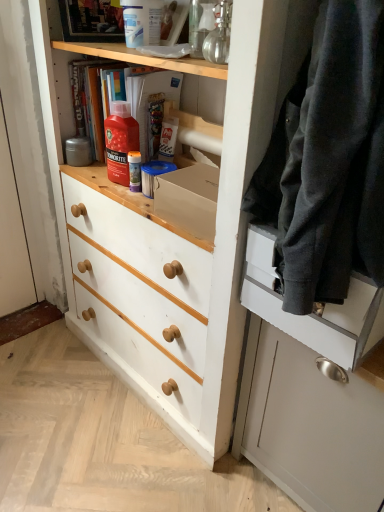
Question: Considering the relative positions of satin white cabinet at right and matte black drawer at right in the image provided, is satin white cabinet at right to the right of matte black drawer at right from the viewer's perspective?

Choices:
 (A) no
 (B) yes

Answer: (B)

Question: From a real-world perspective, is satin white cabinet at right positioned over matte black drawer at right based on gravity?

Choices:
 (A) no
 (B) yes

Answer: (A)

Question: Is matte black drawer at right surrounded by satin white cabinet at right?

Choices:
 (A) no
 (B) yes

Answer: (A)

Question: Does satin white cabinet at right turn towards matte black drawer at right?

Choices:
 (A) yes
 (B) no

Answer: (B)

Question: Can you confirm if satin white cabinet at right is thinner than matte black drawer at right?

Choices:
 (A) yes
 (B) no

Answer: (A)

Question: Is satin white cabinet at right shorter than matte black drawer at right?

Choices:
 (A) no
 (B) yes

Answer: (A)

Question: From the image's perspective, is matte black drawer at right below satin white cabinet at right?

Choices:
 (A) no
 (B) yes

Answer: (A)

Question: Is matte black drawer at right thinner than satin white cabinet at right?

Choices:
 (A) no
 (B) yes

Answer: (A)

Question: Does matte black drawer at right have a greater width compared to satin white cabinet at right?

Choices:
 (A) yes
 (B) no

Answer: (A)

Question: Is matte black drawer at right positioned beyond the bounds of satin white cabinet at right?

Choices:
 (A) no
 (B) yes

Answer: (B)

Question: Is matte black drawer at right at the right side of satin white cabinet at right?

Choices:
 (A) no
 (B) yes

Answer: (A)

Question: Does matte black drawer at right have a greater height compared to satin white cabinet at right?

Choices:
 (A) yes
 (B) no

Answer: (B)

Question: Is satin white cabinet at right closer to the viewer compared to dark gray wool sweater at right?

Choices:
 (A) yes
 (B) no

Answer: (B)